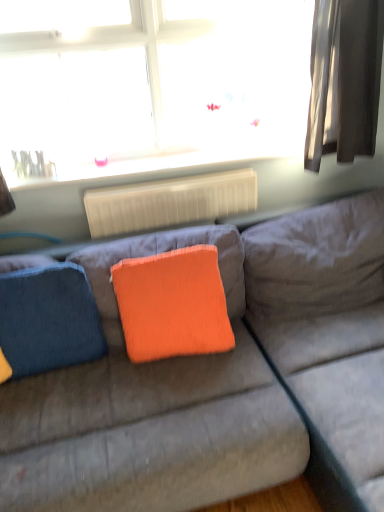
Image resolution: width=384 pixels, height=512 pixels. What do you see at coordinates (151, 166) in the screenshot?
I see `white glossy radiator at upper center` at bounding box center [151, 166].

In order to click on white glossy radiator at upper center in this screenshot , I will do `click(151, 166)`.

The height and width of the screenshot is (512, 384). Describe the element at coordinates (169, 202) in the screenshot. I see `white plastic radiator at center` at that location.

You are a GUI agent. You are given a task and a screenshot of the screen. Output one action in this format:
    pyautogui.click(x=<x>, y=<y>)
    Task: Click on the transparent glass window at upper center
    The height and width of the screenshot is (512, 384).
    Given the screenshot: What is the action you would take?
    pyautogui.click(x=152, y=80)

Where is `velvet orange pillow at center`? velvet orange pillow at center is located at coordinates (219, 379).

The height and width of the screenshot is (512, 384). Find the location of `silky gray curtain at right`. silky gray curtain at right is located at coordinates (344, 79).

Based on the photo, from the image's perspective, is white plastic radiator at center located beneath denim cushion at left?

No, from the image's perspective, white plastic radiator at center is not beneath denim cushion at left.

Based on the photo, considering the relative positions of white plastic radiator at center and denim cushion at left in the image provided, is white plastic radiator at center to the left of denim cushion at left from the viewer's perspective?

Incorrect, white plastic radiator at center is not on the left side of denim cushion at left.

There is a denim cushion at left. Find the location of `radiator above it (from a real-world perspective)`. radiator above it (from a real-world perspective) is located at coordinates (169, 202).

From a real-world perspective, is white plastic radiator at center over denim cushion at left?

Yes, from a real-world perspective, white plastic radiator at center is above denim cushion at left.

Identify the location of studio couch that appears below the orange fabric pillow at center (from a real-world perspective). (219, 379).

Does velvet orange pillow at center touch orange fabric pillow at center?

There is a gap between velvet orange pillow at center and orange fabric pillow at center.

Consider the image. Does velvet orange pillow at center have a lesser height compared to orange fabric pillow at center?

No, velvet orange pillow at center is not shorter than orange fabric pillow at center.

Which point is more forward, (31, 308) or (359, 116)?

Positioned in front is point (31, 308).

From a real-world perspective, between denim cushion at left and silky gray curtain at right, who is vertically lower?

denim cushion at left.

Can you confirm if denim cushion at left is wider than silky gray curtain at right?

No, denim cushion at left is not wider than silky gray curtain at right.

Who is more distant, denim cushion at left or silky gray curtain at right?

silky gray curtain at right is more distant.

From the image's perspective, is white glossy radiator at upper center located above velvet orange pillow at center?

Yes.

In the image, is white glossy radiator at upper center on the left side or the right side of velvet orange pillow at center?

Clearly, white glossy radiator at upper center is on the left of velvet orange pillow at center in the image.

Who is smaller, white glossy radiator at upper center or velvet orange pillow at center?

white glossy radiator at upper center.

Based on the photo, which is closer, (88, 172) or (377, 323)?

Clearly, point (88, 172) is more distant from the camera than point (377, 323).

Are orange fabric pillow at center and velvet orange pillow at center beside each other?

orange fabric pillow at center and velvet orange pillow at center are clearly separated.

From a real-world perspective, does orange fabric pillow at center sit lower than velvet orange pillow at center?

Actually, orange fabric pillow at center is physically above velvet orange pillow at center in the real world.

Is orange fabric pillow at center outside of velvet orange pillow at center?

No, orange fabric pillow at center is inside or overlapping with velvet orange pillow at center.

Could you tell me if orange fabric pillow at center is turned towards velvet orange pillow at center?

Yes, orange fabric pillow at center is turned towards velvet orange pillow at center.

Is orange fabric pillow at center not within transparent glass window at upper center?

That's correct, orange fabric pillow at center is outside of transparent glass window at upper center.

Between orange fabric pillow at center and transparent glass window at upper center, which one appears on the left side from the viewer's perspective?

From the viewer's perspective, transparent glass window at upper center appears more on the left side.

From the image's perspective, between orange fabric pillow at center and transparent glass window at upper center, who is located below?

orange fabric pillow at center, from the image's perspective.

Is transparent glass window at upper center completely or partially outside of velvet orange pillow at center?

That's correct, transparent glass window at upper center is outside of velvet orange pillow at center.

Can you tell me how much transparent glass window at upper center and velvet orange pillow at center differ in facing direction?

The angular difference between transparent glass window at upper center and velvet orange pillow at center is 88.1 degrees.

Is transparent glass window at upper center bigger than velvet orange pillow at center?

No.

Does transparent glass window at upper center have a lesser width compared to velvet orange pillow at center?

Yes.

This screenshot has width=384, height=512. I want to click on pillow in front of the white plastic radiator at center, so click(48, 320).

I want to click on studio couch below the orange fabric pillow at center (from the image's perspective), so click(219, 379).

Looking at the image, which one is located closer to denim cushion at left, white plastic radiator at center or white glossy radiator at upper center?

white plastic radiator at center.

From the image, which object appears to be farther from transparent glass window at upper center, white glossy radiator at upper center or velvet orange pillow at center?

Among the two, velvet orange pillow at center is located further to transparent glass window at upper center.

Which object lies nearer to the anchor point white plastic radiator at center, silky gray curtain at right or white glossy radiator at upper center?

Among the two, white glossy radiator at upper center is located nearer to white plastic radiator at center.

When comparing their distances from orange fabric pillow at center, does denim cushion at left or white glossy radiator at upper center seem further?

white glossy radiator at upper center.

Based on their spatial positions, is white plastic radiator at center or white glossy radiator at upper center further from silky gray curtain at right?

white plastic radiator at center.

Estimate the real-world distances between objects in this image. Which object is further from white glossy radiator at upper center, velvet orange pillow at center or denim cushion at left?

Based on the image, velvet orange pillow at center appears to be further to white glossy radiator at upper center.

Looking at the image, which one is located closer to velvet orange pillow at center, orange fabric pillow at center or silky gray curtain at right?

The object closer to velvet orange pillow at center is orange fabric pillow at center.

Which object lies nearer to the anchor point velvet orange pillow at center, denim cushion at left or white plastic radiator at center?

A: Among the two, denim cushion at left is located nearer to velvet orange pillow at center.

The image size is (384, 512). Identify the location of throw pillow between denim cushion at left and silky gray curtain at right in the horizontal direction. (172, 304).

Image resolution: width=384 pixels, height=512 pixels. In order to click on pillow between velvet orange pillow at center and white glossy radiator at upper center along the z-axis in this screenshot , I will do `click(48, 320)`.

This screenshot has height=512, width=384. I want to click on window sill between velvet orange pillow at center and white plastic radiator at center along the z-axis, so click(151, 166).

The height and width of the screenshot is (512, 384). In order to click on throw pillow positioned between velvet orange pillow at center and silky gray curtain at right from near to far in this screenshot , I will do `click(172, 304)`.